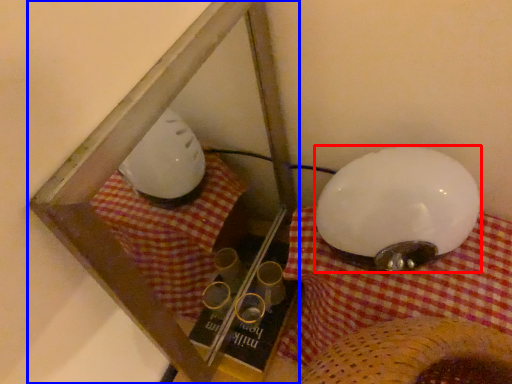
Question: Which object appears closest to the camera in this image, lamp (highlighted by a red box) or glass box (highlighted by a blue box)?

Choices:
 (A) lamp
 (B) glass box

Answer: (B)